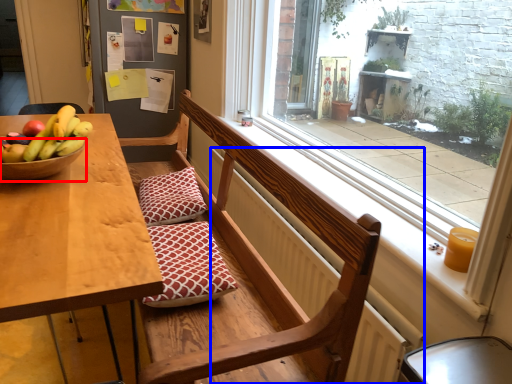
Question: Which object is further to the camera taking this photo, glass bowl (highlighted by a red box) or radiator (highlighted by a blue box)?

Choices:
 (A) glass bowl
 (B) radiator

Answer: (A)